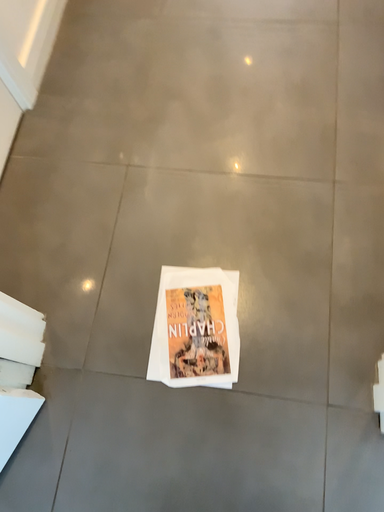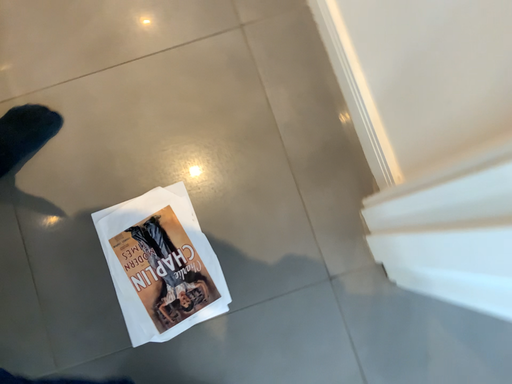
Question: Which way did the camera rotate in the video?

Choices:
 (A) rotated downward
 (B) rotated upward

Answer: (A)